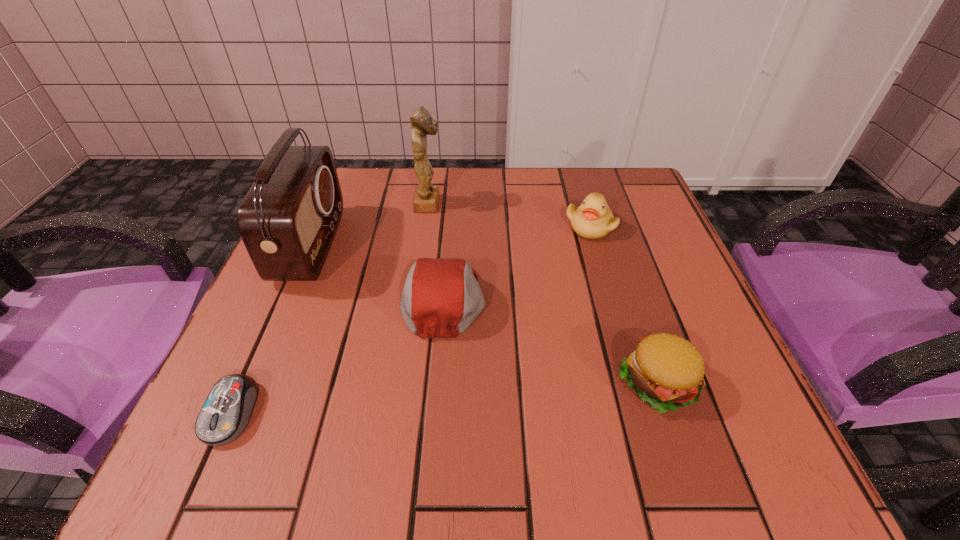
Locate an element on the screen. This screenshot has width=960, height=540. object present at the far left corner is located at coordinates (288, 219).

Where is `object located in the near left corner section of the desktop`? object located in the near left corner section of the desktop is located at coordinates (226, 412).

Locate an element on the screen. This screenshot has height=540, width=960. object located in the far right corner section of the desktop is located at coordinates (593, 219).

You are a GUI agent. You are given a task and a screenshot of the screen. Output one action in this format:
    pyautogui.click(x=<x>, y=<y>)
    Task: Click on the object at the near right corner
    The width and height of the screenshot is (960, 540).
    Given the screenshot: What is the action you would take?
    pyautogui.click(x=666, y=371)

In the image, there is a desktop. Where is `free space at the far edge`? The height and width of the screenshot is (540, 960). free space at the far edge is located at coordinates (536, 191).

Locate an element on the screen. free space at the left edge of the desktop is located at coordinates (287, 319).

The image size is (960, 540). What are the coordinates of `free region at the right edge of the desktop` in the screenshot? It's located at (601, 240).

Identify the location of vacant region at the far left corner. This screenshot has height=540, width=960. pyautogui.click(x=349, y=211).

In the image, there is a desktop. Identify the location of vacant space at the far right corner. This screenshot has width=960, height=540. (644, 181).

The image size is (960, 540). I want to click on unoccupied position between the radio receiver and the computer mouse, so click(x=271, y=329).